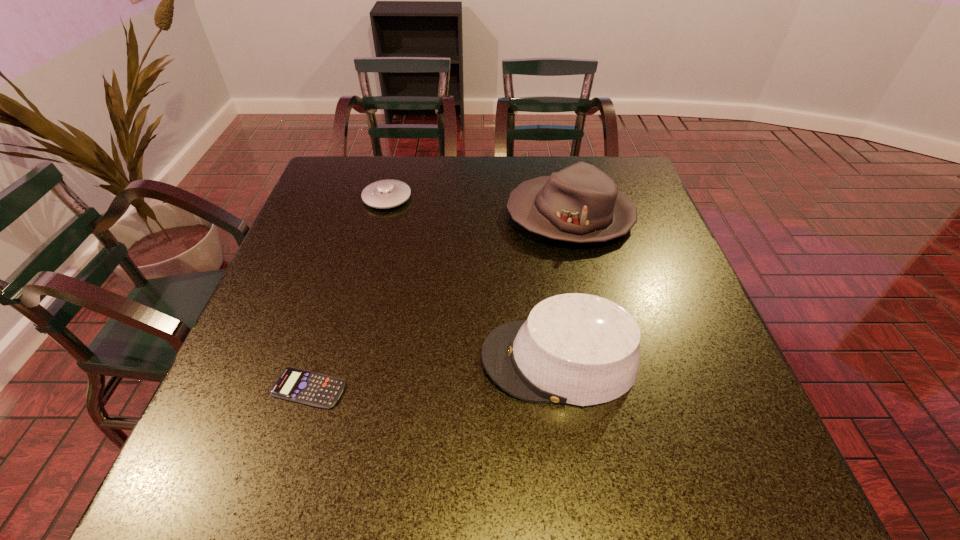
Where is `unoccupied position between the tallest object and the calculator`? unoccupied position between the tallest object and the calculator is located at coordinates (440, 302).

Image resolution: width=960 pixels, height=540 pixels. I want to click on free space between the nearer hat and the calculator, so click(434, 374).

In order to click on unoccupied area between the shortest object and the third shortest object in this screenshot , I will do `click(434, 374)`.

Identify the location of free area in between the second shortest object and the farther hat. Image resolution: width=960 pixels, height=540 pixels. (479, 207).

I want to click on free area in between the shorter hat and the third tallest object, so click(473, 279).

Identify the location of free spot between the shortest object and the farther hat. The image size is (960, 540). (440, 302).

Identify which object is located as the third nearest to the nearer hat. Please provide its 2D coordinates. Your answer should be formatted as a tuple, i.e. [(x, y)], where the tuple contains the x and y coordinates of a point satisfying the conditions above.

[(389, 193)]

The image size is (960, 540). Find the location of `object identified as the closest to the shortest object`. object identified as the closest to the shortest object is located at coordinates (578, 349).